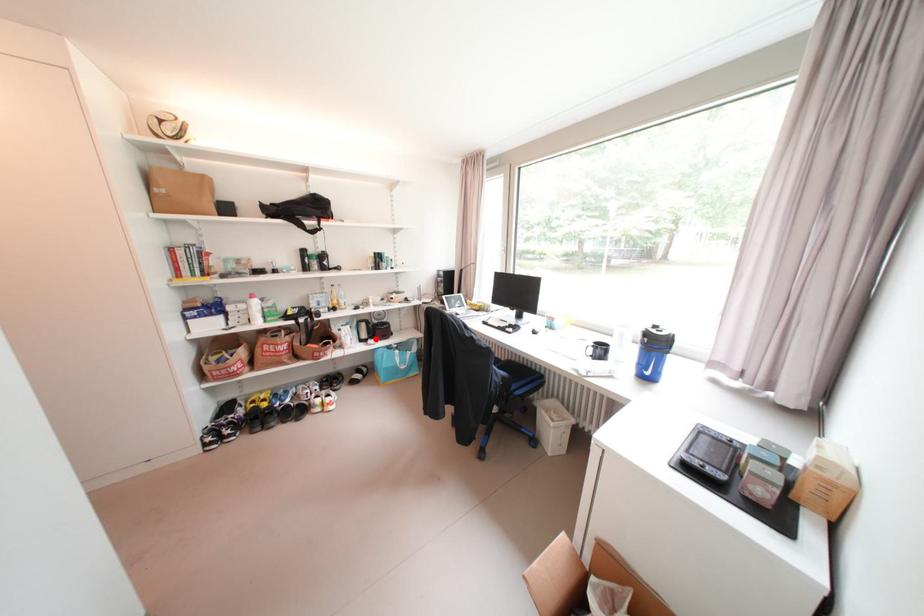
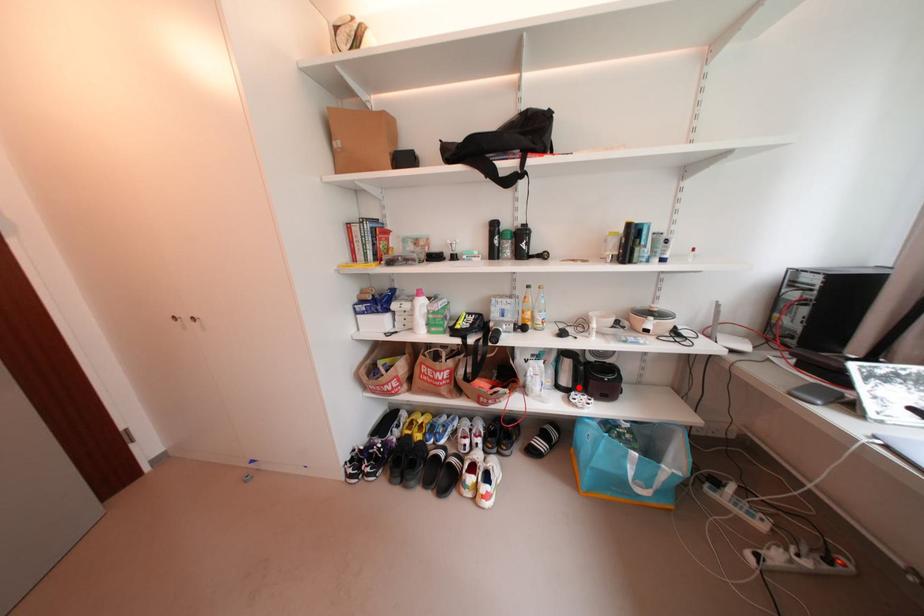
I am providing you with two images of the same scene from different viewpoints. A red point is marked on the first image and another point is marked on the second image. Is the marked point in image1 the same physical position as the marked point in image2?

Yes